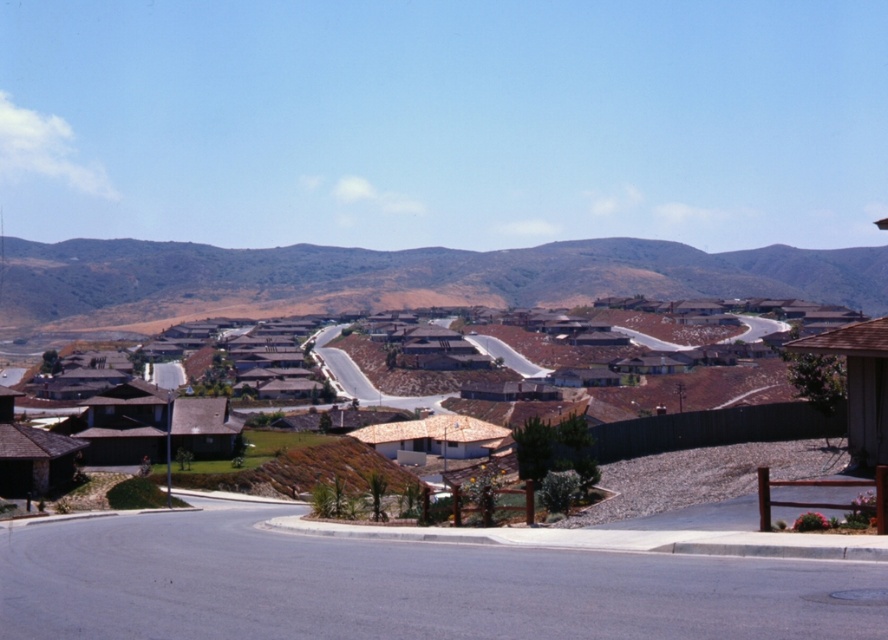
Is brown/dry grassy hillside at upper center thinner than brown tile roof houses at center?

No, brown/dry grassy hillside at upper center is not thinner than brown tile roof houses at center.

Does brown/dry grassy hillside at upper center have a greater height compared to brown tile roof houses at center?

Correct, brown/dry grassy hillside at upper center is much taller as brown tile roof houses at center.

Which is behind, point (422, 259) or point (715, 486)?

The point (422, 259) is more distant.

Find the location of a particular element. The height and width of the screenshot is (640, 888). brown/dry grassy hillside at upper center is located at coordinates (398, 278).